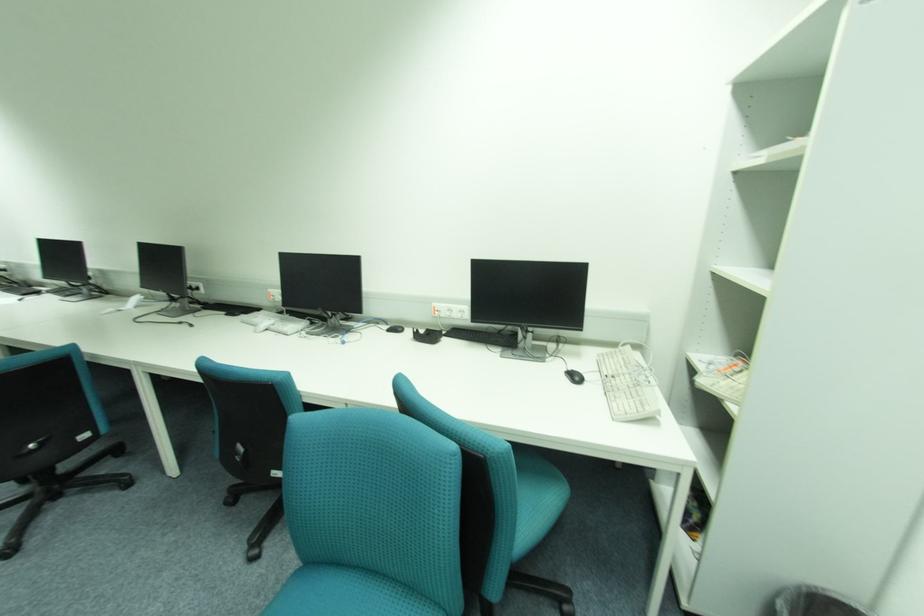
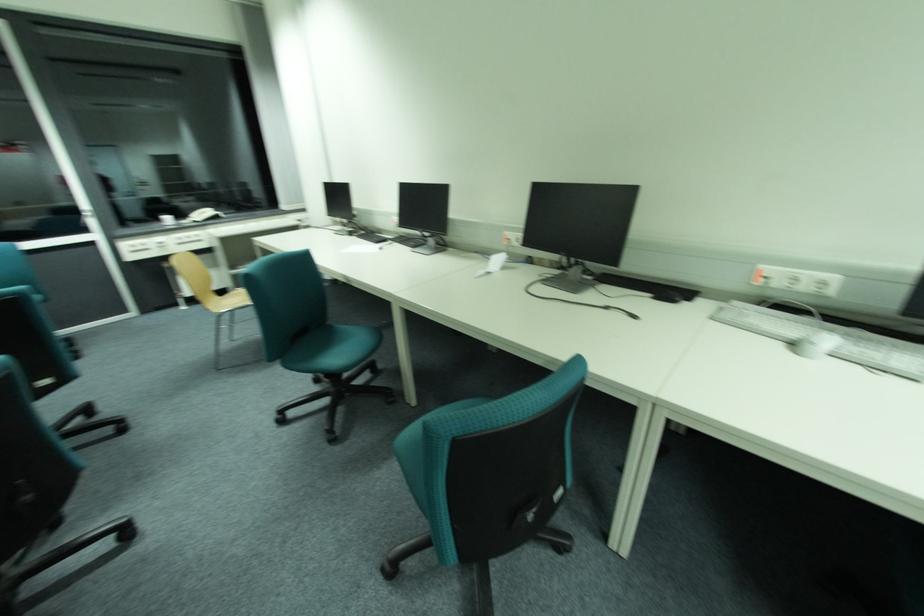
Locate, in the second image, the point that corresponds to (268,312) in the first image.

(743, 304)